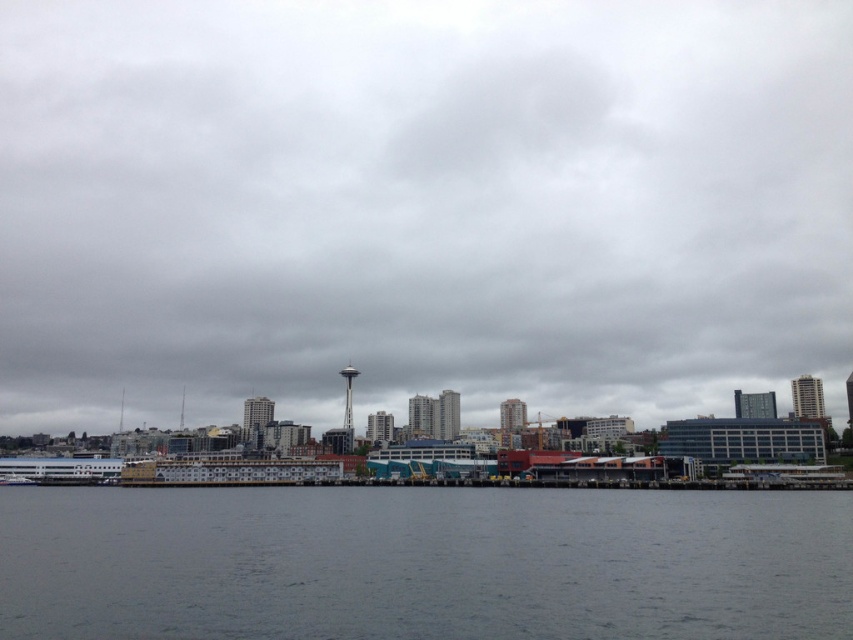
You are standing at the waterfront and looking out at the scene. Which object, the gray cloudy sky at center or the gray water at lower center, is positioned to the left of the other?

The gray cloudy sky at center is positioned to the left of gray water at lower center.

You are a photographer planning to take a reflection shot of the Space Needle in the gray water at lower center. Since the gray cloudy sky at center is in the way, will you need to adjust your position to see the reflection clearly?

The gray cloudy sky at center is located above the gray water at lower center, so the reflection of the Space Needle may be obscured by the sky. To capture the reflection clearly, you should position yourself so that the Space Needle is directly behind you, allowing its reflection in the water to be visible without interference from the sky.

You are a bird flying at an altitude of 200 meters. You want to land on the gray cloudy sky at center. Can you reach it without adjusting your flight altitude?

The gray cloudy sky at center is 217.99 meters away from the viewer. Since the bird is flying at 200 meters, it cannot reach the gray cloudy sky at center as it is 17.99 meters higher than the bird.